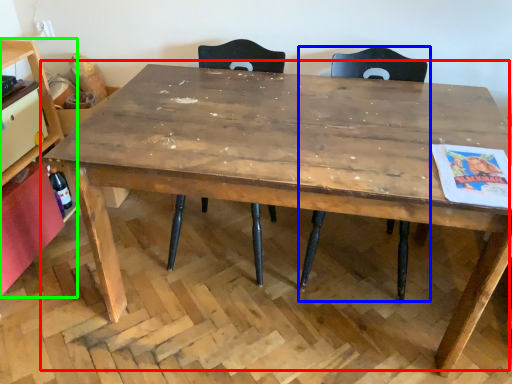
Question: Which is nearer to the table (highlighted by a red box)? chair (highlighted by a blue box) or shelf (highlighted by a green box).

Choices:
 (A) chair
 (B) shelf

Answer: (A)